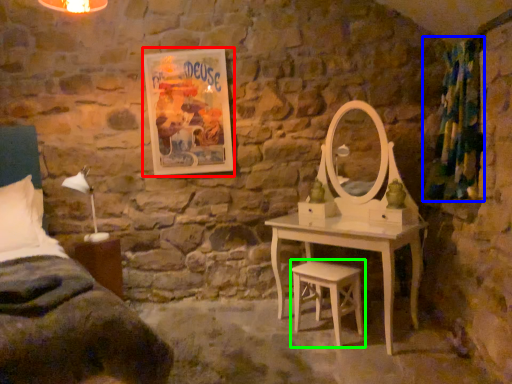
Question: Considering the real-world distances, which object is closest to picture frame (highlighted by a red box)? curtain (highlighted by a blue box) or stool (highlighted by a green box).

Choices:
 (A) curtain
 (B) stool

Answer: (B)